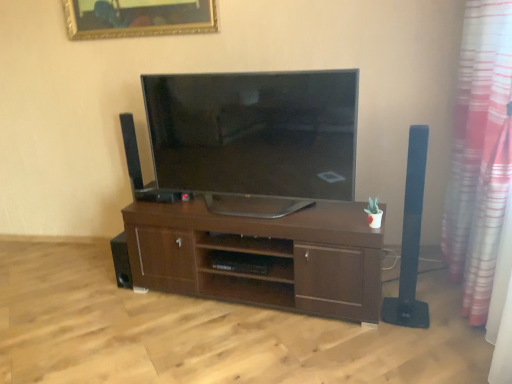
Image resolution: width=512 pixels, height=384 pixels. Identify the location of vacant area that lies between black matte speaker at right, marked as the 1th speaker in a right-to-left arrangement, and pink striped curtain at right. (432, 327).